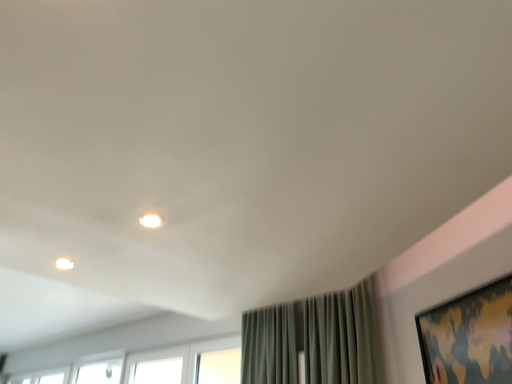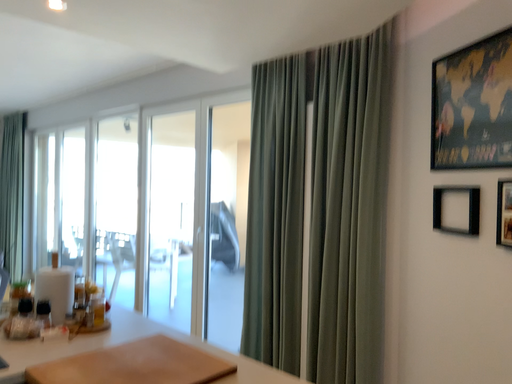
Question: How did the camera likely rotate when shooting the video?

Choices:
 (A) rotated downward
 (B) rotated upward

Answer: (A)